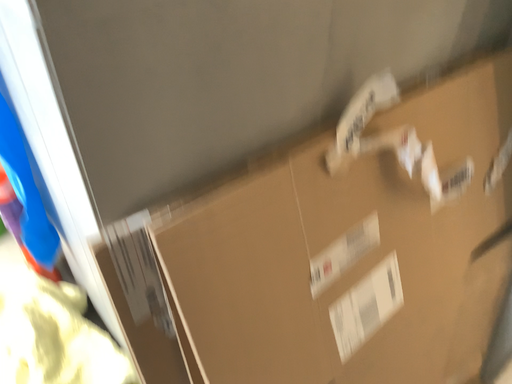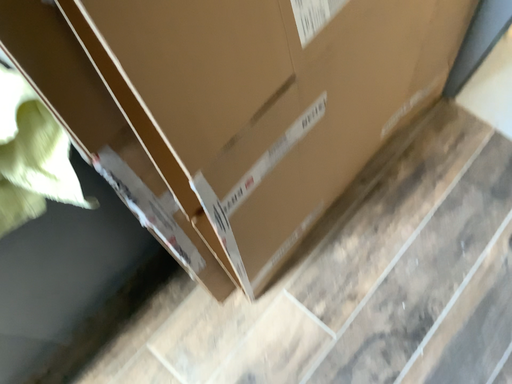
Question: How did the camera likely rotate when shooting the video?

Choices:
 (A) rotated upward
 (B) rotated downward

Answer: (B)